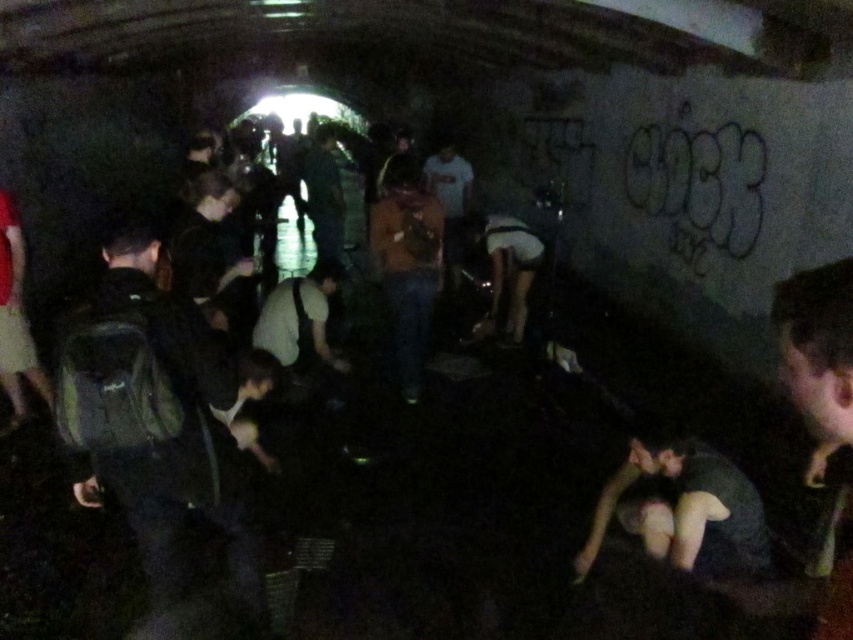
Question: Among these points, which one is nearest to the camera?

Choices:
 (A) (325, 173)
 (B) (535, 264)
 (C) (619, 476)
 (D) (236, 497)

Answer: (D)

Question: Is dark green backpack at left bigger than white matte shorts at center?

Choices:
 (A) yes
 (B) no

Answer: (B)

Question: Observing the image, what is the correct spatial positioning of dark green backpack at left in reference to dark gray fabric at lower right?

Choices:
 (A) below
 (B) above

Answer: (B)

Question: Which object appears closest to the camera in this image?

Choices:
 (A) orange fabric shirt at center
 (B) dark green backpack at left
 (C) dark green shirt at center
 (D) dark gray fabric at lower right

Answer: (B)

Question: Can you confirm if dark gray fabric at lower right is thinner than orange fabric shirt at center?

Choices:
 (A) no
 (B) yes

Answer: (A)

Question: Which is farther from the white matte shorts at center?

Choices:
 (A) dark green backpack at left
 (B) dark gray fabric at lower right

Answer: (A)